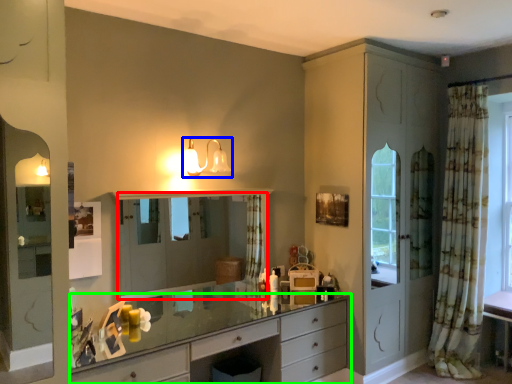
Question: Based on their relative distances, which object is nearer to mirror (highlighted by a red box)? Choose from light fixture (highlighted by a blue box) and chest of drawers (highlighted by a green box).

Choices:
 (A) light fixture
 (B) chest of drawers

Answer: (A)